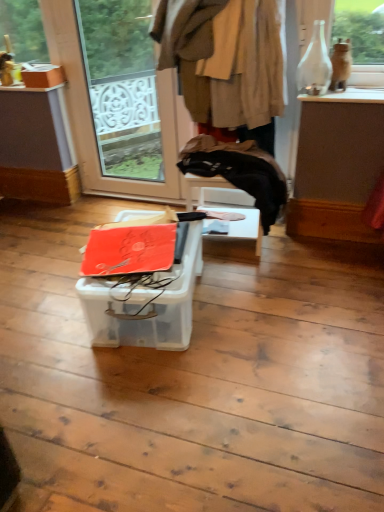
Question: Is the position of white glossy vase at upper right more distant than that of brown woolen coat at upper center?

Choices:
 (A) yes
 (B) no

Answer: (A)

Question: Is white glossy vase at upper right closer to the viewer compared to brown woolen coat at upper center?

Choices:
 (A) no
 (B) yes

Answer: (A)

Question: From a real-world perspective, is white glossy vase at upper right positioned over brown woolen coat at upper center based on gravity?

Choices:
 (A) yes
 (B) no

Answer: (B)

Question: Does white glossy vase at upper right appear on the left side of brown woolen coat at upper center?

Choices:
 (A) yes
 (B) no

Answer: (B)

Question: Can you confirm if white glossy vase at upper right is bigger than brown woolen coat at upper center?

Choices:
 (A) no
 (B) yes

Answer: (A)

Question: From the image's perspective, does white glossy vase at upper right appear lower than brown woolen coat at upper center?

Choices:
 (A) no
 (B) yes

Answer: (B)

Question: Can you confirm if white glossy vase at upper right is thinner than matte cardboard box at upper left, marked as the 1th cardboard box in a top-to-bottom arrangement?

Choices:
 (A) yes
 (B) no

Answer: (B)

Question: From the image's perspective, does white glossy vase at upper right appear lower than matte cardboard box at upper left, the 1th cardboard box in the back-to-front sequence?

Choices:
 (A) no
 (B) yes

Answer: (B)

Question: Considering the relative sizes of white glossy vase at upper right and matte cardboard box at upper left, marked as the first cardboard box in a left-to-right arrangement, in the image provided, is white glossy vase at upper right shorter than matte cardboard box at upper left, marked as the first cardboard box in a left-to-right arrangement,?

Choices:
 (A) no
 (B) yes

Answer: (B)

Question: Is white glossy vase at upper right facing towards matte cardboard box at upper left, positioned as the 2th cardboard box in front-to-back order?

Choices:
 (A) no
 (B) yes

Answer: (A)

Question: Is white glossy vase at upper right positioned with its back to matte cardboard box at upper left, marked as the first cardboard box in a left-to-right arrangement?

Choices:
 (A) no
 (B) yes

Answer: (A)

Question: Is white glossy vase at upper right bigger than matte cardboard box at upper left, marked as the 2th cardboard box in a right-to-left arrangement?

Choices:
 (A) no
 (B) yes

Answer: (B)

Question: Is orange matte cardboard box at center, placed as the 1th cardboard box when sorted from right to left, not within brown woolen coat at upper center?

Choices:
 (A) no
 (B) yes

Answer: (B)